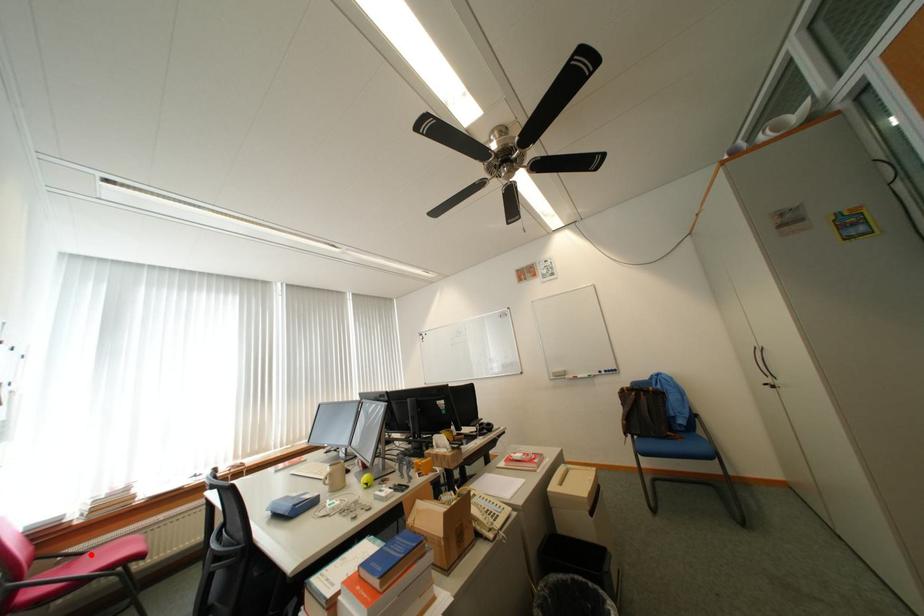
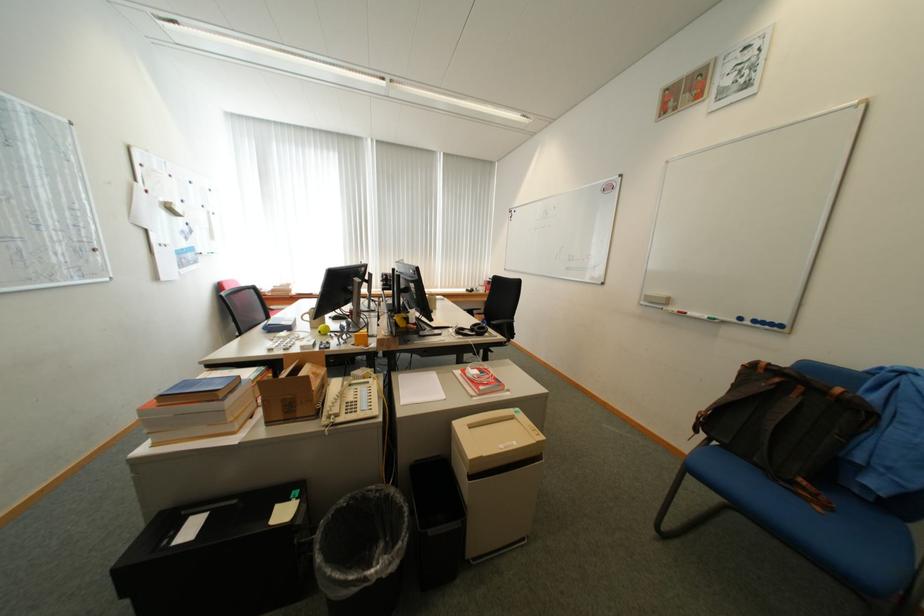
Question: I am providing you with two images of the same scene from different viewpoints. A red point is marked on the first image. At the location where the point appears in image 1, is it still visible in image 2?

Choices:
 (A) Yes
 (B) No

Answer: (B)